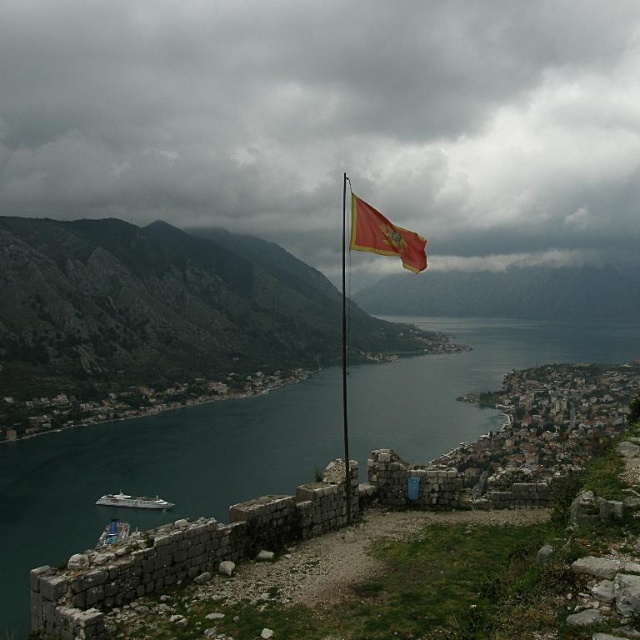
Measure the distance between green water at center and red fabric flag at center.

green water at center and red fabric flag at center are 214.68 meters apart from each other.

Is green water at center to the left of red fabric flag at center from the viewer's perspective?

No, green water at center is not to the left of red fabric flag at center.

Is point (454, 404) in front of point (406, 243)?

No.

Identify the location of green water at center. click(x=156, y=470).

Is red fabric flag at center shorter than red flag at center?

Yes, red fabric flag at center is shorter than red flag at center.

Between point (355, 208) and point (346, 376), which one is positioned in front?

Point (355, 208)

The image size is (640, 640). What are the coordinates of `red fabric flag at center` in the screenshot? It's located at (385, 236).

Does green water at center have a lesser width compared to red flag at center?

In fact, green water at center might be wider than red flag at center.

Which is in front, point (349, 387) or point (346, 512)?

Point (346, 512) is more forward.

Between point (336, 413) and point (340, 209), which one is positioned in front?

Point (336, 413) is more forward.

At what (x,y) coordinates should I click in order to perform the action: click on green water at center. Please return your answer as a coordinate pair (x, y). Looking at the image, I should click on (156, 470).